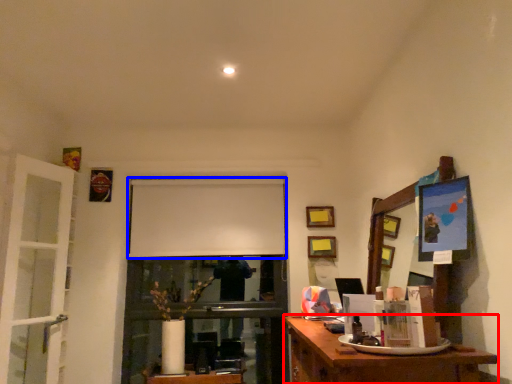
Question: Which of the following is the closest to the observer, desk (highlighted by a red box) or projection screen (highlighted by a blue box)?

Choices:
 (A) desk
 (B) projection screen

Answer: (A)